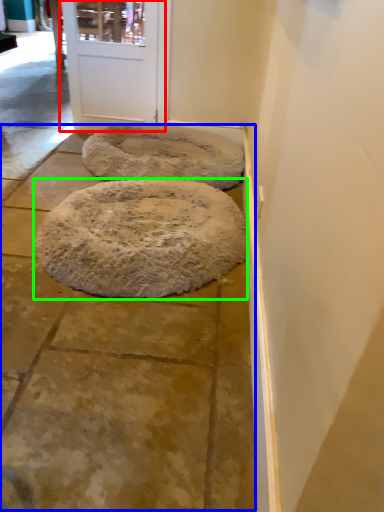
Question: Estimate the real-world distances between objects in this image. Which object is closer to door (highlighted by a red box), pavement (highlighted by a blue box) or dog bed (highlighted by a green box)?

Choices:
 (A) pavement
 (B) dog bed

Answer: (B)